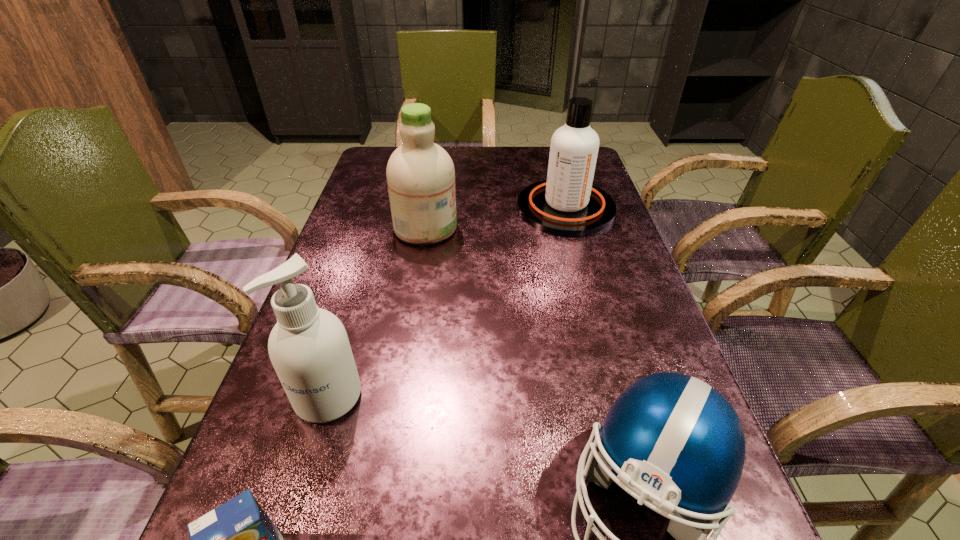
This screenshot has height=540, width=960. What are the coordinates of `the closest object to the shortest object` in the screenshot? It's located at (309, 348).

Locate which object ranks fourth in proximity to the football helmet. Please provide its 2D coordinates. Your answer should be formatted as a tuple, i.e. [(x, y)], where the tuple contains the x and y coordinates of a point satisfying the conditions above.

[(566, 204)]

Locate which cleansing agent ranks second in proximity to the football helmet. Please provide its 2D coordinates. Your answer should be formatted as a tuple, i.e. [(x, y)], where the tuple contains the x and y coordinates of a point satisfying the conditions above.

[(420, 174)]

Identify which cleansing agent is the second nearest to the nearest cleansing agent. Please provide its 2D coordinates. Your answer should be formatted as a tuple, i.e. [(x, y)], where the tuple contains the x and y coordinates of a point satisfying the conditions above.

[(566, 204)]